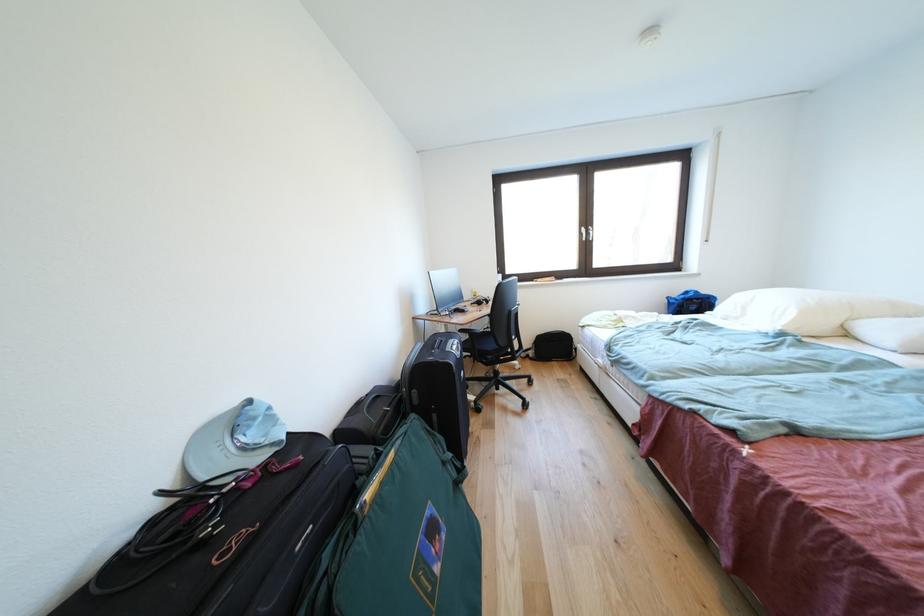
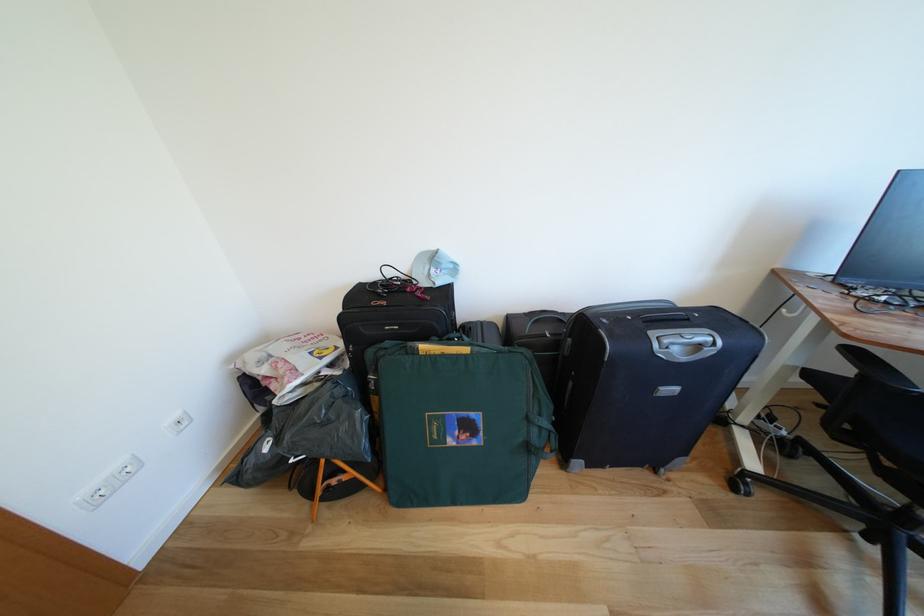
Find the pixel in the second image that matches pixel 469 334 in the first image.

(862, 357)